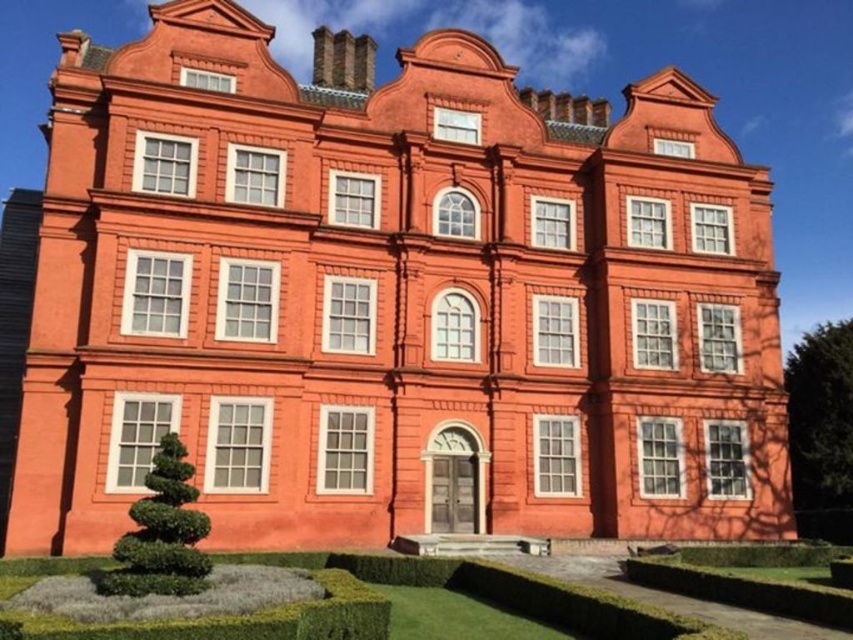
You are a landscape architect planning to install a new pathway between the green hedge at lower center and the green leafy hedge at lower left. The pathway requires a minimum width of 6 meters to accommodate foot traffic. Based on the scene, will the existing space between these two hedges allow for the installation of this pathway?

The distance between the green hedge at lower center and the green leafy hedge at lower left is 6.66 meters, which exceeds the required 6 meters. Therefore, the pathway can be installed between them.

You are standing in front of the three story building. You see a point labeled as point (x=508, y=593). What is located at this point?

The green hedge at lower center is located at point (x=508, y=593).

You are standing in front of the building and want to walk towards the green hedge at lower center and the green leafy hedge at lower left. Which hedge will you reach first?

The green hedge at lower center is closer to the viewer than the green leafy hedge at lower left, so you will reach the green hedge at lower center first.